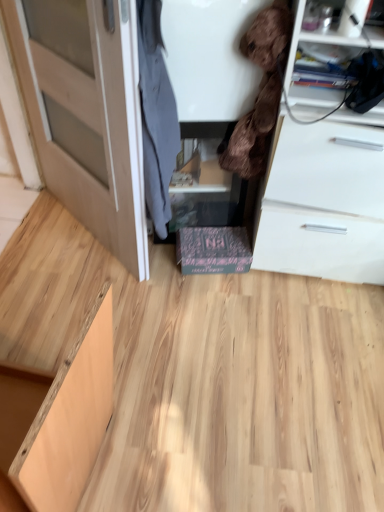
Where is `vacant space that is to the left of black cardboard box at center, the first cabinetry from the back`? vacant space that is to the left of black cardboard box at center, the first cabinetry from the back is located at coordinates (160, 272).